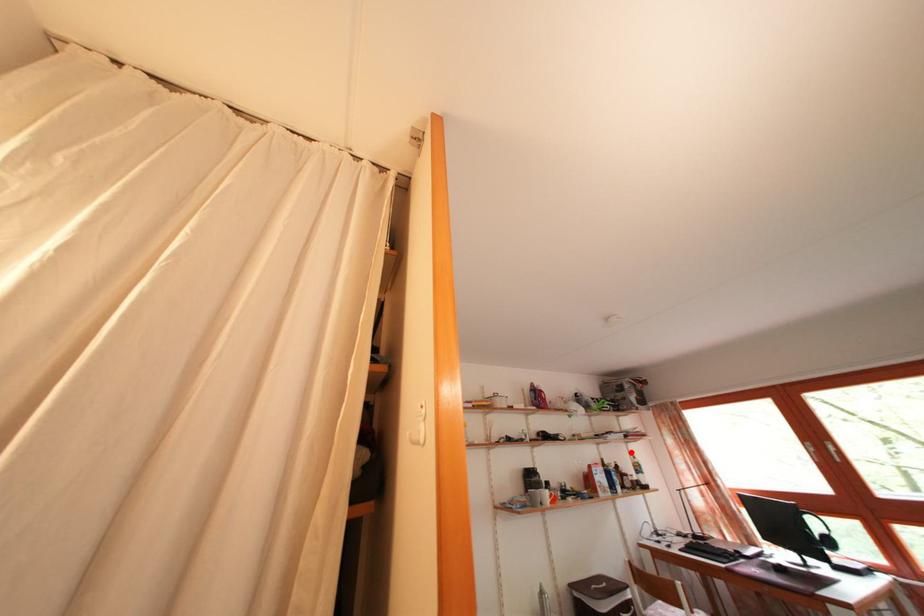
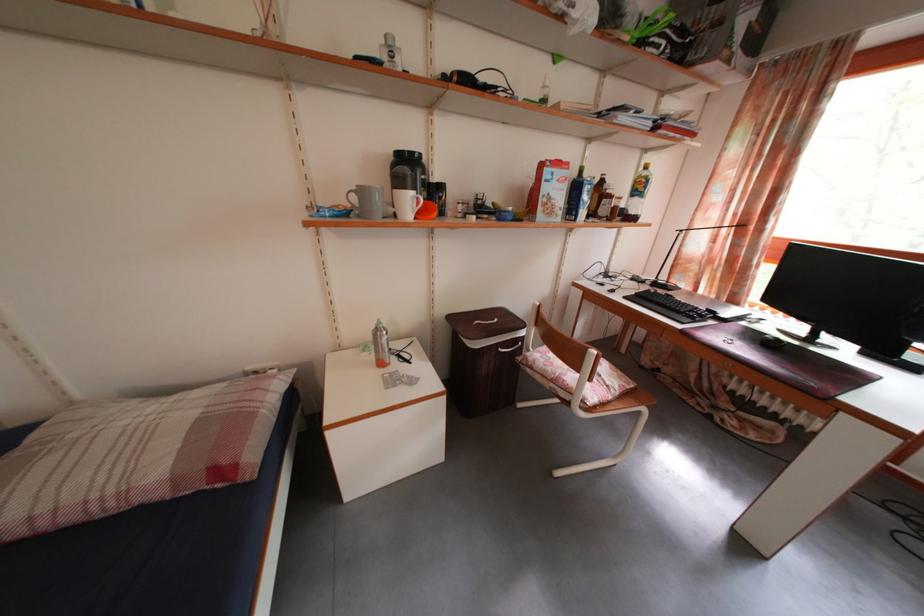
In the second image, find the point that corresponds to the highlighted location in the first image.

(643, 161)